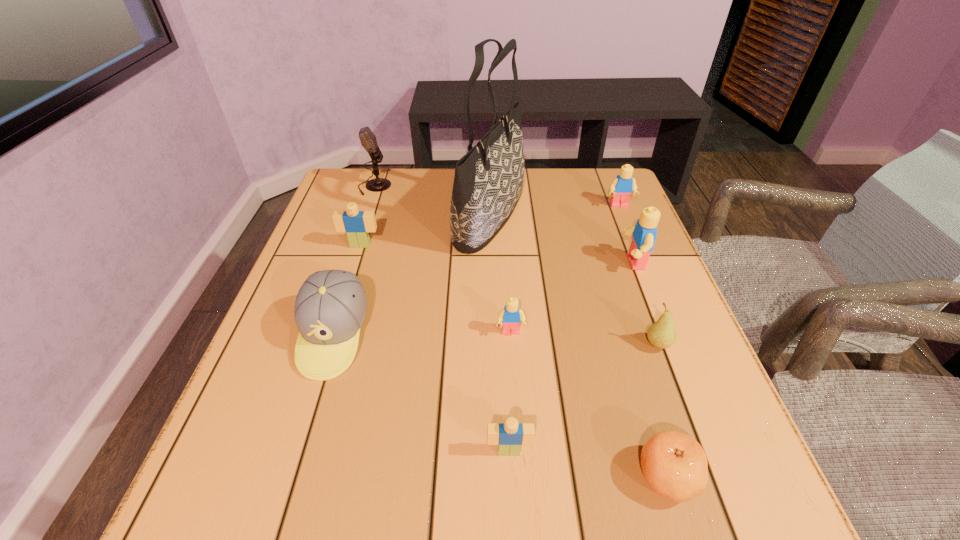
The width and height of the screenshot is (960, 540). I want to click on vacant space at the far edge of the desktop, so click(544, 178).

Where is `free region at the near edge of the desktop`? free region at the near edge of the desktop is located at coordinates (593, 498).

Image resolution: width=960 pixels, height=540 pixels. Find the location of `vacant space at the left edge`. vacant space at the left edge is located at coordinates (295, 301).

At what (x,y) coordinates should I click in order to perform the action: click on vacant region at the right edge of the desktop. Please return your answer as a coordinate pair (x, y). Looking at the image, I should click on (654, 356).

Where is `free region at the far left corner`? free region at the far left corner is located at coordinates [x=378, y=208].

Locate an element on the screen. The height and width of the screenshot is (540, 960). free spot at the far right corner of the desktop is located at coordinates (602, 190).

Where is `vacant space that's between the microphone and the clementine`? The image size is (960, 540). vacant space that's between the microphone and the clementine is located at coordinates (521, 332).

This screenshot has height=540, width=960. In order to click on empty space between the orange clementine and the leftmost Lego in this screenshot , I will do `click(514, 361)`.

Locate an element on the screen. vacant region between the tote bag and the second nearest yellow Lego is located at coordinates (562, 239).

Where is `vacant area that lies between the tallest Lego and the nearer beige Lego`? The height and width of the screenshot is (540, 960). vacant area that lies between the tallest Lego and the nearer beige Lego is located at coordinates (571, 356).